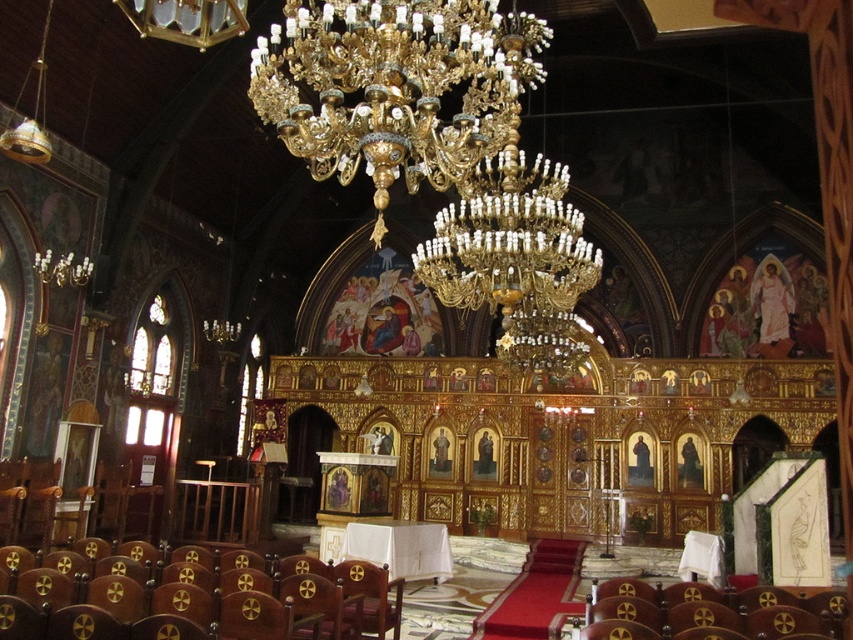
Between gold/glass chandelier at center and brown leather chair at lower right, which one has more height?

Standing taller between the two is gold/glass chandelier at center.

Which is in front, point (502, 305) or point (727, 596)?

Point (727, 596) is more forward.

The image size is (853, 640). I want to click on gold/glass chandelier at center, so click(x=514, y=257).

Between wooden with gold crosses at lower left and brown leather chair at lower right, which one has less height?

wooden with gold crosses at lower left is shorter.

Is wooden with gold crosses at lower left smaller than brown leather chair at lower right?

Correct, wooden with gold crosses at lower left occupies less space than brown leather chair at lower right.

Is point (245, 572) more distant than point (714, 612)?

Yes, point (245, 572) is farther from viewer.

The width and height of the screenshot is (853, 640). What are the coordinates of `wooden with gold crosses at lower left` in the screenshot? It's located at (183, 604).

Who is higher up, gold/gilded chandelier at upper center or brown leather chair at lower right?

gold/gilded chandelier at upper center is above.

From the picture: Is gold/gilded chandelier at upper center closer to the viewer compared to brown leather chair at lower right?

That is False.

Consider the image. Who is more forward, (x=447, y=40) or (x=775, y=593)?

Point (x=775, y=593) is in front.

Where is `gold/gilded chandelier at upper center`? gold/gilded chandelier at upper center is located at coordinates (395, 86).